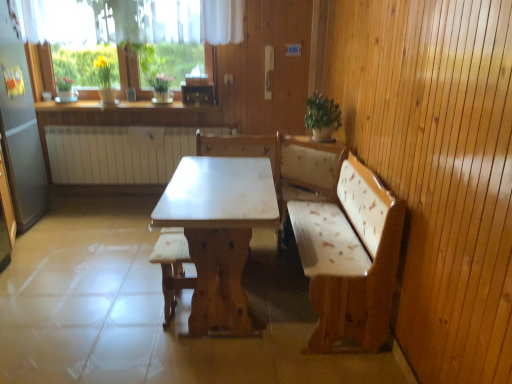
This screenshot has width=512, height=384. I want to click on blank area to the left of white marble table at center, so click(99, 301).